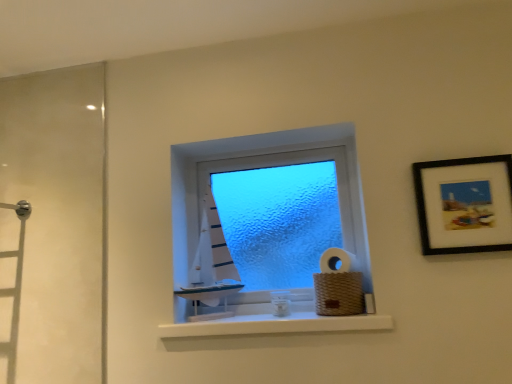
Looking at this image, what is the approximate width of white matte window sill at center?

white matte window sill at center is 7.85 inches wide.

This screenshot has width=512, height=384. I want to click on white matte toilet paper at center, which is the second toilet paper in bottom-to-top order, so click(337, 261).

In the scene shown: What is the approximate width of blue frosted glass window at center?

2.52 inches.

What is the approximate width of white matte sailboat at center?

It is 9.32 inches.

This screenshot has height=384, width=512. Describe the element at coordinates (464, 204) in the screenshot. I see `black matte picture frame at upper right` at that location.

Measure the distance between point [451,233] and camera.

The depth of point [451,233] is 4.50 feet.

Where is `white matte window sill at center`? white matte window sill at center is located at coordinates (277, 318).

Between white matte window sill at center and black matte picture frame at upper right, which one has larger size?

white matte window sill at center is bigger.

In the scene shown: Considering the positions of objects white matte window sill at center and black matte picture frame at upper right in the image provided, who is more to the left, white matte window sill at center or black matte picture frame at upper right?

From the viewer's perspective, white matte window sill at center appears more on the left side.

Based on the photo, could you tell me if white matte window sill at center is turned towards black matte picture frame at upper right?

No, white matte window sill at center is not aimed at black matte picture frame at upper right.

Does white matte window sill at center have a lesser height compared to black matte picture frame at upper right?

Indeed, white matte window sill at center has a lesser height compared to black matte picture frame at upper right.

Could blue frosted glass window at center be considered to be inside white matte window sill at center?

No, white matte window sill at center does not contain blue frosted glass window at center.

From the picture: From the image's perspective, is white matte window sill at center above blue frosted glass window at center?

No, from the image's perspective, white matte window sill at center is not on top of blue frosted glass window at center.

Based on the photo, are white matte window sill at center and blue frosted glass window at center located far from each other?

No, there isn't a large distance between white matte window sill at center and blue frosted glass window at center.

At what (x,y) coordinates should I click in order to perform the action: click on window sill in front of the blue frosted glass window at center. Please return your answer as a coordinate pair (x, y). Looking at the image, I should click on (277, 318).

Is blue frosted glass window at center facing away from black matte picture frame at upper right?

No, blue frosted glass window at center is not facing the opposite direction of black matte picture frame at upper right.

From a real-world perspective, is blue frosted glass window at center above or below black matte picture frame at upper right?

From a real-world perspective, blue frosted glass window at center is physically below black matte picture frame at upper right.

Between blue frosted glass window at center and black matte picture frame at upper right, which one appears on the left side from the viewer's perspective?

Positioned to the left is blue frosted glass window at center.

From a real-world perspective, which object stands above the other?

blue frosted glass window at center.

Which of these two, blue frosted glass window at center or white matte sailboat at center, is bigger?

Bigger between the two is blue frosted glass window at center.

Can we say blue frosted glass window at center lies outside white matte sailboat at center?

Indeed, blue frosted glass window at center is completely outside white matte sailboat at center.

Is blue frosted glass window at center positioned with its back to white matte sailboat at center?

Yes, blue frosted glass window at center is positioned with its back facing white matte sailboat at center.

There is a black matte picture frame at upper right. Where is `the 1st toilet paper below it (from a real-world perspective)`? The image size is (512, 384). the 1st toilet paper below it (from a real-world perspective) is located at coordinates (337, 261).

Based on their positions, is white matte toilet paper at center, which is the second toilet paper in bottom-to-top order, located to the left or right of black matte picture frame at upper right?

In the image, white matte toilet paper at center, which is the second toilet paper in bottom-to-top order, appears on the left side of black matte picture frame at upper right.

Is white matte toilet paper at center, which ranks as the 1th toilet paper in top-to-bottom order, facing towards black matte picture frame at upper right?

No.

Considering the positions of objects white matte toilet paper at center, which ranks as the 1th toilet paper in top-to-bottom order, and black matte picture frame at upper right in the image provided, who is in front, white matte toilet paper at center, which ranks as the 1th toilet paper in top-to-bottom order, or black matte picture frame at upper right?

black matte picture frame at upper right.

Looking at their sizes, would you say woven brown basket at lower right, which ranks as the 2th toilet paper in top-to-bottom order, is wider or thinner than white matte sailboat at center?

woven brown basket at lower right, which ranks as the 2th toilet paper in top-to-bottom order, is thinner than white matte sailboat at center.

Based on the photo, would you say woven brown basket at lower right, which ranks as the 2th toilet paper in top-to-bottom order, is to the left or to the right of white matte sailboat at center in the picture?

woven brown basket at lower right, which ranks as the 2th toilet paper in top-to-bottom order, is positioned on white matte sailboat at center's right side.

Is woven brown basket at lower right, which ranks as the 2th toilet paper in top-to-bottom order, positioned before white matte sailboat at center?

Yes, woven brown basket at lower right, which ranks as the 2th toilet paper in top-to-bottom order, is in front of white matte sailboat at center.

From a real-world perspective, is woven brown basket at lower right, which ranks as the 2th toilet paper in top-to-bottom order, positioned over white matte sailboat at center based on gravity?

No, from a real-world perspective, woven brown basket at lower right, which ranks as the 2th toilet paper in top-to-bottom order, is not on top of white matte sailboat at center.

How many degrees apart are the facing directions of white matte sailboat at center and black matte picture frame at upper right?

The facing directions of white matte sailboat at center and black matte picture frame at upper right are 9.85 degrees apart.

Is white matte sailboat at center facing away from black matte picture frame at upper right?

No.

From the image's perspective, which is above, white matte sailboat at center or black matte picture frame at upper right?

black matte picture frame at upper right.

Is white matte sailboat at center beside black matte picture frame at upper right?

No, white matte sailboat at center is not beside black matte picture frame at upper right.

Locate an element on the screen. This screenshot has width=512, height=384. window sill that appears below the black matte picture frame at upper right (from the image's perspective) is located at coordinates (277, 318).

At what (x,y) coordinates should I click in order to perform the action: click on window behind the white matte window sill at center. Please return your answer as a coordinate pair (x, y). Looking at the image, I should click on (258, 166).

Looking at the image, which one is located closer to woven brown basket at lower right, positioned as the first toilet paper in bottom-to-top order, white matte toilet paper at center, which ranks as the 1th toilet paper in top-to-bottom order, or blue frosted glass window at center?

white matte toilet paper at center, which ranks as the 1th toilet paper in top-to-bottom order, is closer to woven brown basket at lower right, positioned as the first toilet paper in bottom-to-top order.

Based on their spatial positions, is white matte window sill at center or white matte sailboat at center closer to white matte toilet paper at center, which ranks as the 1th toilet paper in top-to-bottom order?

white matte window sill at center is closer to white matte toilet paper at center, which ranks as the 1th toilet paper in top-to-bottom order.

Considering their positions, is black matte picture frame at upper right positioned further to white matte window sill at center than woven brown basket at lower right, positioned as the first toilet paper in bottom-to-top order?

black matte picture frame at upper right is positioned further to the anchor white matte window sill at center.

Looking at the image, which one is located further to white matte window sill at center, black matte picture frame at upper right or blue frosted glass window at center?

black matte picture frame at upper right is further to white matte window sill at center.

Based on their spatial positions, is white matte toilet paper at center, which ranks as the 1th toilet paper in top-to-bottom order, or white matte sailboat at center closer to woven brown basket at lower right, positioned as the first toilet paper in bottom-to-top order?

white matte toilet paper at center, which ranks as the 1th toilet paper in top-to-bottom order.

From the image, which object appears to be farther from black matte picture frame at upper right, woven brown basket at lower right, positioned as the first toilet paper in bottom-to-top order, or white matte sailboat at center?

Among the two, white matte sailboat at center is located further to black matte picture frame at upper right.

Looking at the image, which one is located closer to blue frosted glass window at center, white matte toilet paper at center, which ranks as the 1th toilet paper in top-to-bottom order, or black matte picture frame at upper right?

Based on the image, white matte toilet paper at center, which ranks as the 1th toilet paper in top-to-bottom order, appears to be nearer to blue frosted glass window at center.

From the image, which object appears to be nearer to blue frosted glass window at center, black matte picture frame at upper right or white matte window sill at center?

Based on the image, white matte window sill at center appears to be nearer to blue frosted glass window at center.

Where is `toilet paper between white matte window sill at center and white matte toilet paper at center, which ranks as the 1th toilet paper in top-to-bottom order, from left to right`? This screenshot has width=512, height=384. toilet paper between white matte window sill at center and white matte toilet paper at center, which ranks as the 1th toilet paper in top-to-bottom order, from left to right is located at coordinates (338, 285).

I want to click on window located between white matte sailboat at center and white matte toilet paper at center, which ranks as the 1th toilet paper in top-to-bottom order, in the left-right direction, so click(258, 166).

In order to click on curtain between blue frosted glass window at center and white matte window sill at center in the up-down direction in this screenshot , I will do 213,257.

Where is `toilet paper between blue frosted glass window at center and white matte toilet paper at center, which ranks as the 1th toilet paper in top-to-bottom order, in the horizontal direction`? The width and height of the screenshot is (512, 384). toilet paper between blue frosted glass window at center and white matte toilet paper at center, which ranks as the 1th toilet paper in top-to-bottom order, in the horizontal direction is located at coordinates (338, 285).